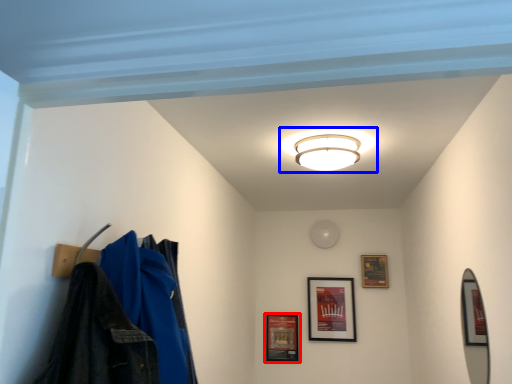
Question: Among these objects, which one is nearest to the camera, picture frame (highlighted by a red box) or lamp (highlighted by a blue box)?

Choices:
 (A) picture frame
 (B) lamp

Answer: (B)